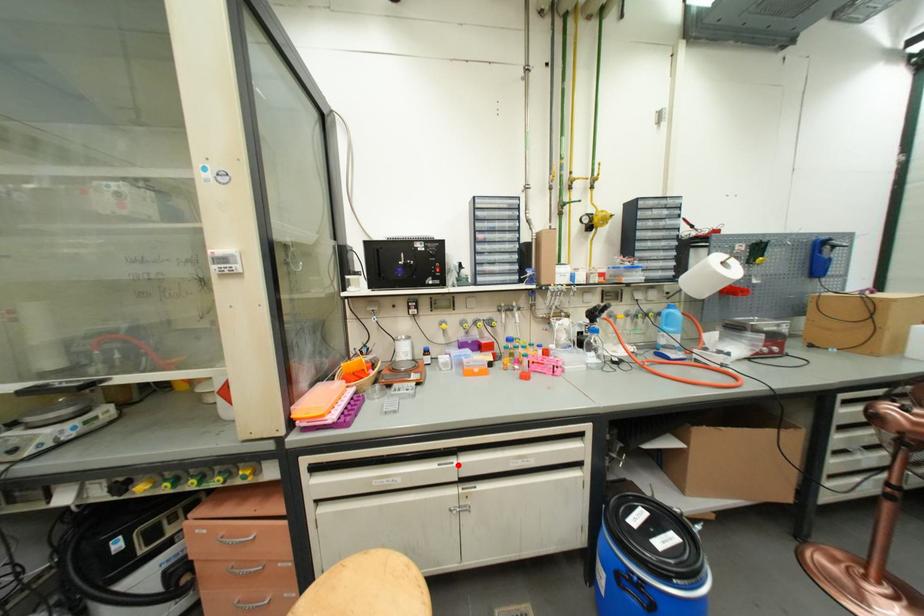
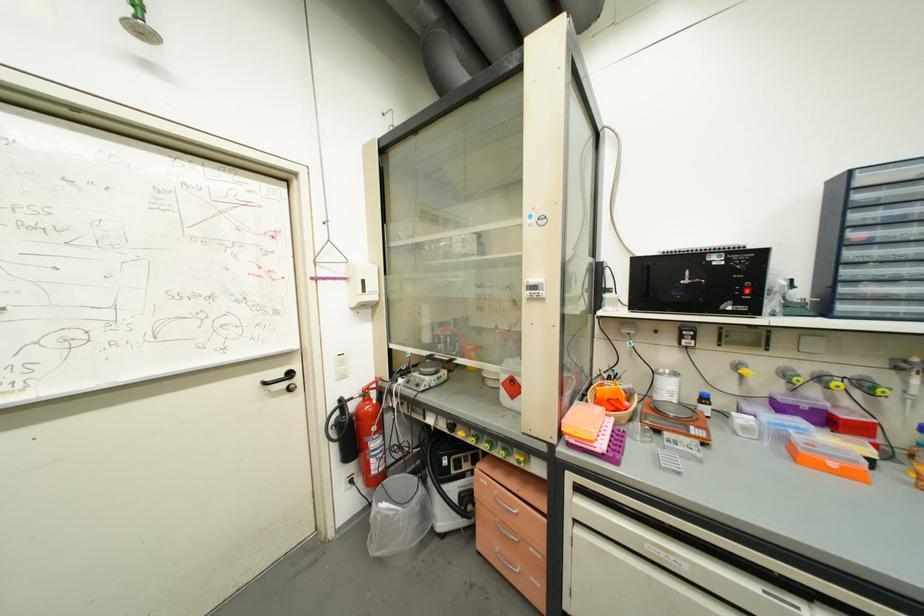
Question: A red point is marked in image1. In image2, is the corresponding 3D point closer to the camera or farther? Reply with the corresponding letter.

Choices:
 (A) The corresponding 3D point is closer.
 (B) The corresponding 3D point is farther.

Answer: (A)